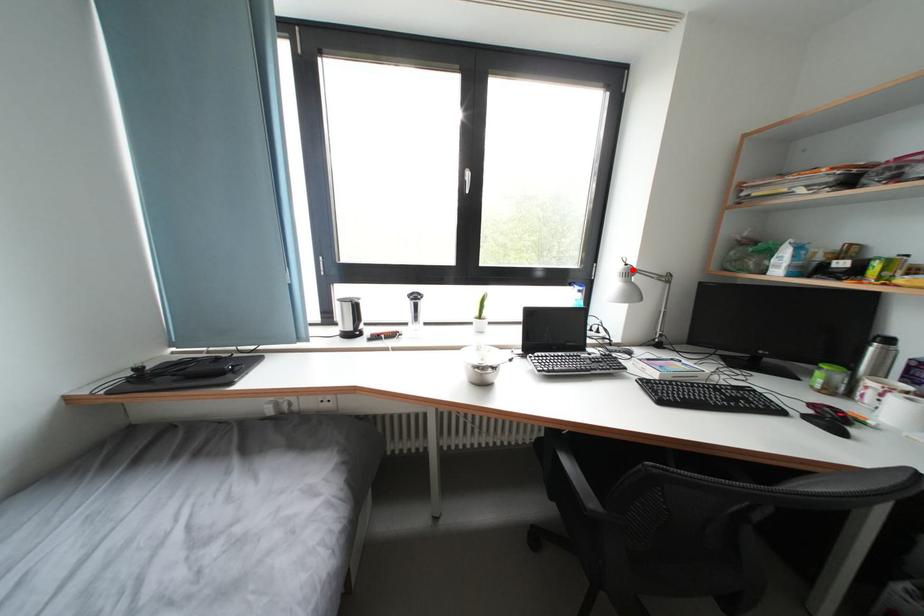
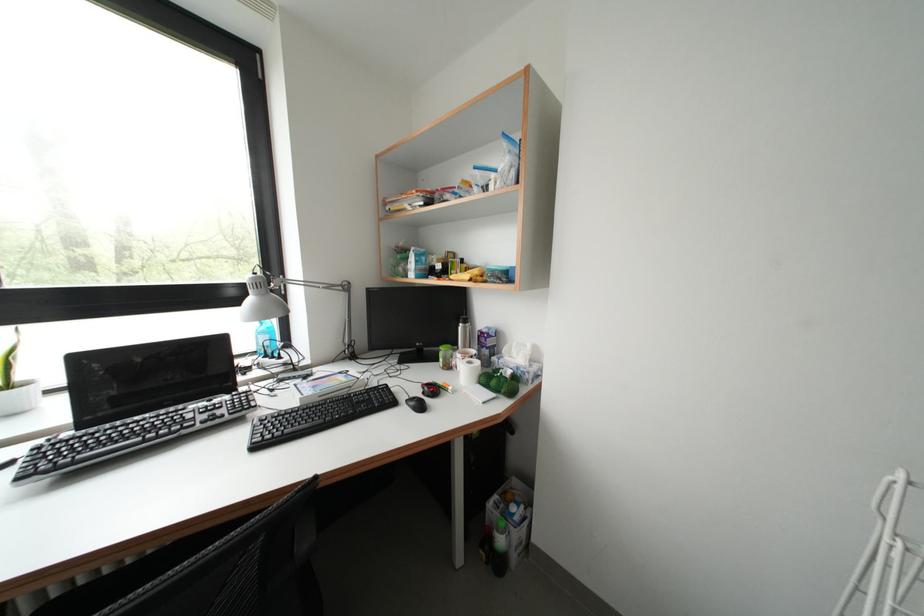
Find the pixel in the second image that matches the highlighted location in the first image.

(261, 278)